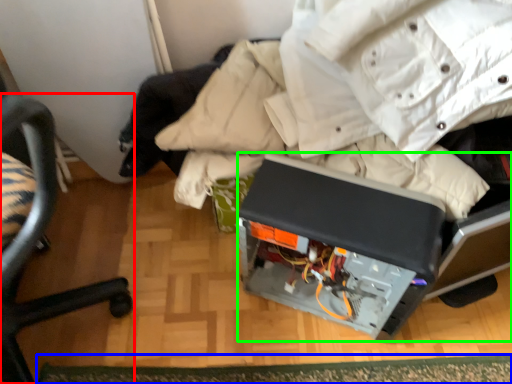
Question: Estimate the real-world distances between objects in this image. Which object is farther from chair (highlighted by a red box), mat (highlighted by a blue box) or wide (highlighted by a green box)?

Choices:
 (A) mat
 (B) wide

Answer: (B)